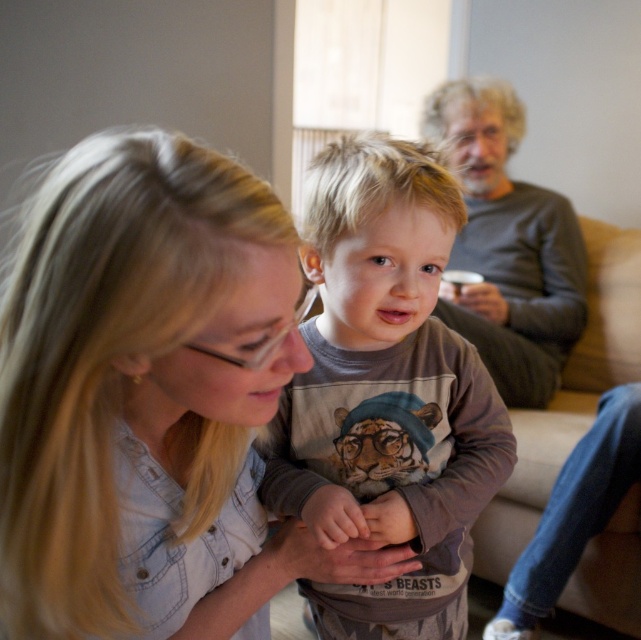
Can you confirm if denim shirt at center is positioned below beige fabric couch at lower right?

No.

How much distance is there between denim shirt at center and beige fabric couch at lower right?

denim shirt at center and beige fabric couch at lower right are 1.28 meters apart from each other.

Who is more distant from viewer, [40,627] or [570,600]?

The point [570,600] is behind.

Locate an element on the screen. This screenshot has width=641, height=640. denim shirt at center is located at coordinates (151, 401).

Identify the location of denim shirt at center. (151, 401).

Who is higher up, denim shirt at center or brown cotton shirt at center?

denim shirt at center

Who is more forward, (229, 330) or (428, 353)?

Point (229, 330) is more forward.

Locate an element on the screen. The image size is (641, 640). denim shirt at center is located at coordinates (151, 401).

Can you confirm if beige fabric couch at lower right is bigger than gray sweater at upper right?

Incorrect, beige fabric couch at lower right is not larger than gray sweater at upper right.

Between beige fabric couch at lower right and gray sweater at upper right, which one appears on the left side from the viewer's perspective?

gray sweater at upper right

Does point (629, 248) come behind point (508, 264)?

Yes, it is.

You are a GUI agent. You are given a task and a screenshot of the screen. Output one action in this format:
    pyautogui.click(x=<x>, y=<y>)
    Task: Click on the beige fabric couch at lower right
    
    Given the screenshot: What is the action you would take?
    pyautogui.click(x=578, y=460)